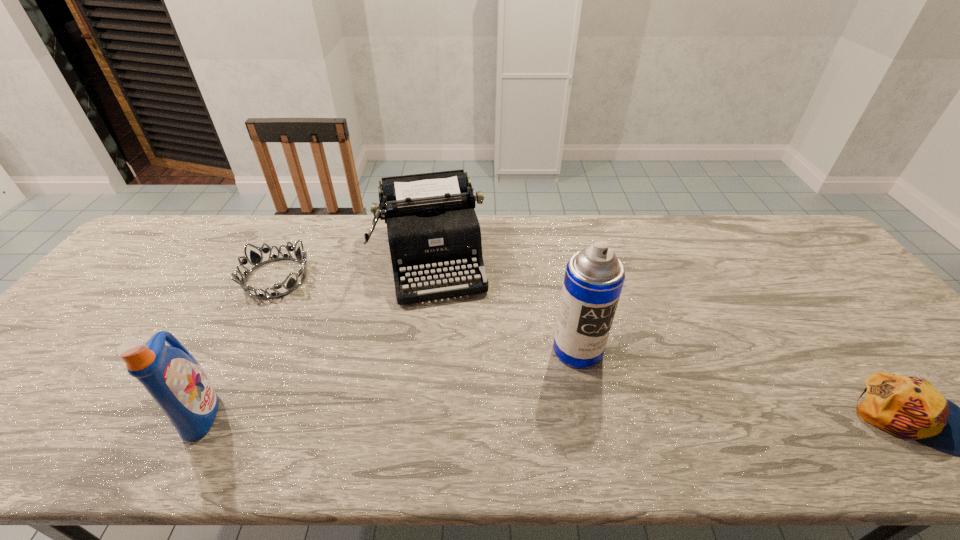
I want to click on the fourth shortest object, so point(172,376).

Locate an element on the screen. Image resolution: width=960 pixels, height=540 pixels. the third tallest object is located at coordinates (433, 231).

The image size is (960, 540). In order to click on typewriter in this screenshot , I will do `click(433, 231)`.

Find the location of a particular element. Image resolution: width=960 pixels, height=540 pixels. tiara is located at coordinates (256, 260).

The height and width of the screenshot is (540, 960). Identify the location of the tallest object. (594, 277).

This screenshot has width=960, height=540. Identify the location of the third farthest object. (594, 277).

You are a GUI agent. You are given a task and a screenshot of the screen. Output one action in this format:
    pyautogui.click(x=<x>, y=<y>)
    Task: Click on the vacant space situated 0.100m on the label of the second tallest object
    This screenshot has height=540, width=960.
    Given the screenshot: What is the action you would take?
    pyautogui.click(x=265, y=412)

This screenshot has height=540, width=960. Identify the location of vacant position located on the typing side of the third shortest object. click(453, 378).

I want to click on vacant space located 0.070m on the typing side of the third shortest object, so click(x=443, y=325).

You are a GUI agent. You are given a task and a screenshot of the screen. Output one action in this format:
    pyautogui.click(x=<x>, y=<y>)
    Task: Click on the vacant area situated on the typing side of the third shortest object
    This screenshot has width=960, height=540.
    Given the screenshot: What is the action you would take?
    pyautogui.click(x=444, y=336)